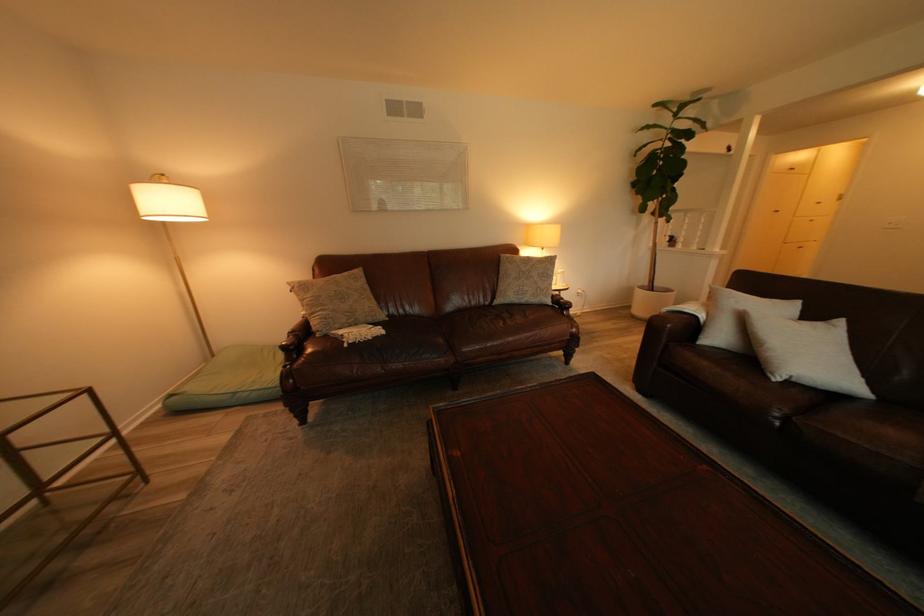
What do you see at coordinates (859, 426) in the screenshot?
I see `the dark sofa surface` at bounding box center [859, 426].